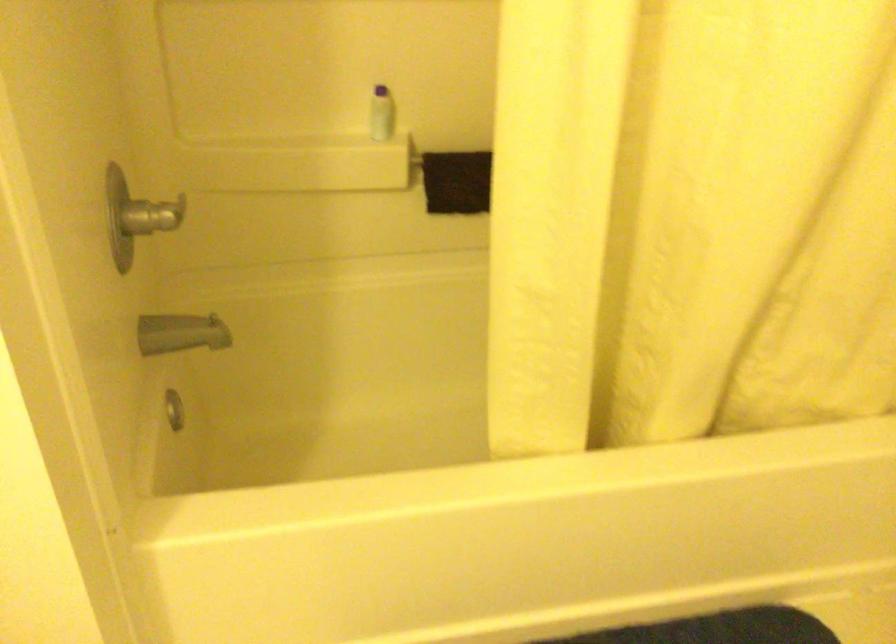
This screenshot has height=644, width=896. What do you see at coordinates (181, 333) in the screenshot?
I see `a metal faucet handle` at bounding box center [181, 333].